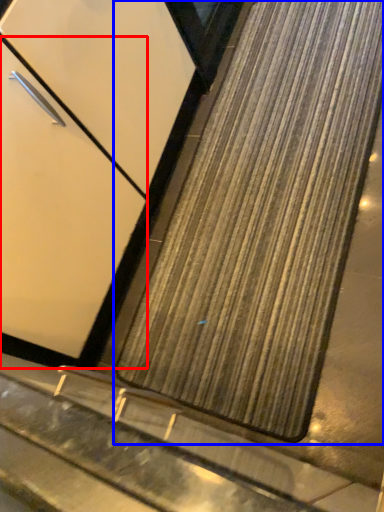
Question: Which of the following is the closest to the observer, door (highlighted by a red box) or mat (highlighted by a blue box)?

Choices:
 (A) door
 (B) mat

Answer: (A)